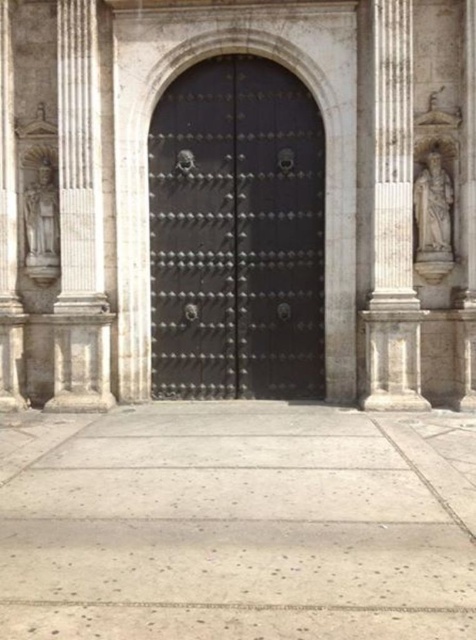
Question: Is polished metal door at center smaller than white marble statue at right?

Choices:
 (A) yes
 (B) no

Answer: (B)

Question: Among these objects, which one is nearest to the camera?

Choices:
 (A) polished stone statue at left
 (B) white marble statue at right
 (C) polished metal door at center

Answer: (B)

Question: Is polished metal door at center positioned behind white marble statue at right?

Choices:
 (A) yes
 (B) no

Answer: (A)

Question: Which is nearer to the polished metal door at center?

Choices:
 (A) white marble statue at right
 (B) polished stone statue at left

Answer: (B)

Question: Does polished metal door at center have a lesser width compared to polished stone statue at left?

Choices:
 (A) yes
 (B) no

Answer: (B)

Question: Which of the following is the farthest from the observer?

Choices:
 (A) (232, 275)
 (B) (47, 243)
 (C) (438, 216)

Answer: (A)